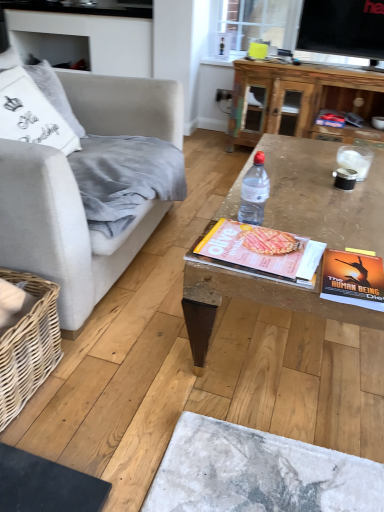
Find the location of a particular element. Image resolution: width=384 pixels, height=512 pixels. empty space that is ontop of hardcover book at center right (from a real-world perspective) is located at coordinates (353, 278).